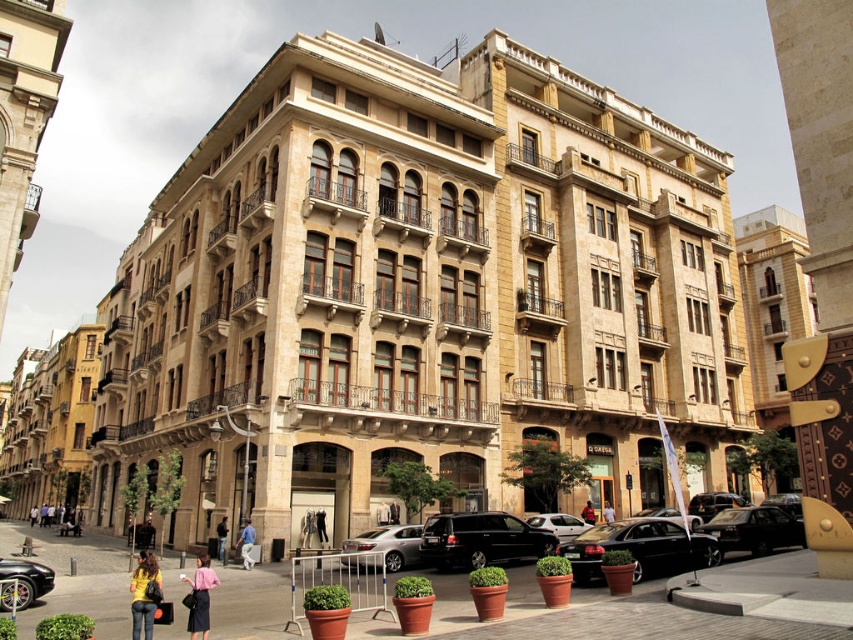
Who is shorter, yellow matte shirt at lower left or denim jacket at center?

denim jacket at center

Who is higher up, yellow matte shirt at lower left or denim jacket at center?

Result: denim jacket at center is above.

Where is `yellow matte shirt at lower left`? This screenshot has height=640, width=853. yellow matte shirt at lower left is located at coordinates (143, 595).

Between shiny black suv at center and shiny black car at center, which one appears on the right side from the viewer's perspective?

Positioned to the right is shiny black car at center.

The width and height of the screenshot is (853, 640). What do you see at coordinates (480, 540) in the screenshot?
I see `shiny black suv at center` at bounding box center [480, 540].

Where is `shiny black suv at center`? shiny black suv at center is located at coordinates [480, 540].

Locate an element on the screen. This screenshot has width=853, height=640. shiny black suv at center is located at coordinates (480, 540).

This screenshot has width=853, height=640. What do you see at coordinates (26, 579) in the screenshot?
I see `shiny black car at lower left` at bounding box center [26, 579].

Measure the distance between shiny black car at lower left and camera.

shiny black car at lower left and camera are 37.37 meters apart from each other.

Who is more distant from viewer, (3, 577) or (190, 611)?

Positioned behind is point (3, 577).

In order to click on shiny black car at lower left in this screenshot , I will do `click(26, 579)`.